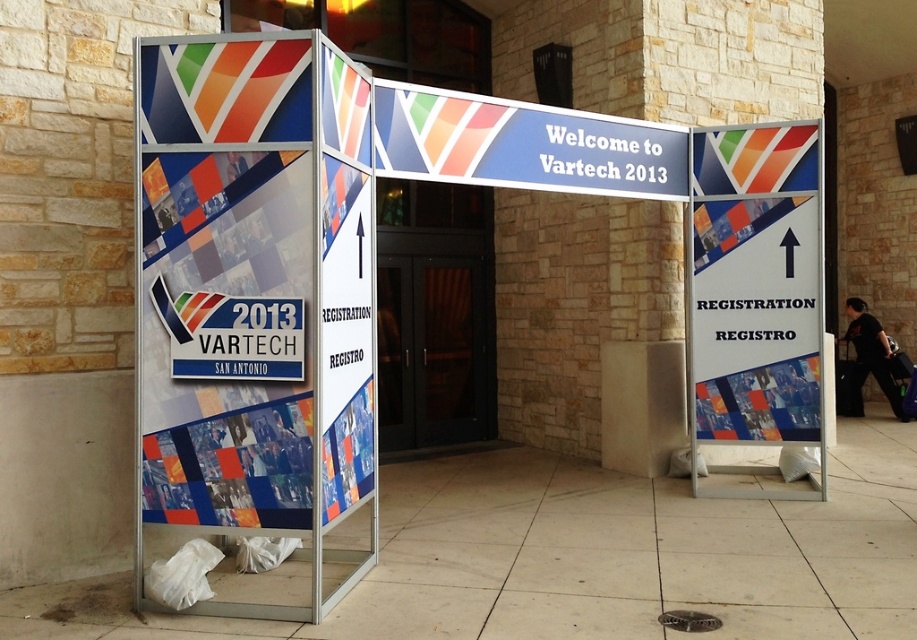
Is matte plastic sign at center further to camera compared to blue glossy sign at center?

No, it is not.

Is matte plastic sign at center above blue glossy sign at center?

No.

Does point (228, 436) come closer to viewer compared to point (412, 179)?

Yes, point (228, 436) is closer to viewer.

At what (x,y) coordinates should I click in order to perform the action: click on matte plastic sign at center. Please return your answer as a coordinate pair (x, y). The image size is (917, 640). Looking at the image, I should click on (253, 296).

Can you confirm if matte plastic sign at center is wider than white plastic sign at center?

Indeed, matte plastic sign at center has a greater width compared to white plastic sign at center.

Is point (297, 76) behind point (779, 291)?

No, it is not.

Does point (279, 467) come in front of point (699, 337)?

Yes, it is in front of point (699, 337).

Where is `matte plastic sign at center`? matte plastic sign at center is located at coordinates (253, 296).

Is white plastic sign at center positioned in front of blue glossy sign at center?

No, it is not.

Is point (779, 204) in front of point (388, 141)?

No, (779, 204) is behind (388, 141).

Locate an element on the screen. white plastic sign at center is located at coordinates (757, 291).